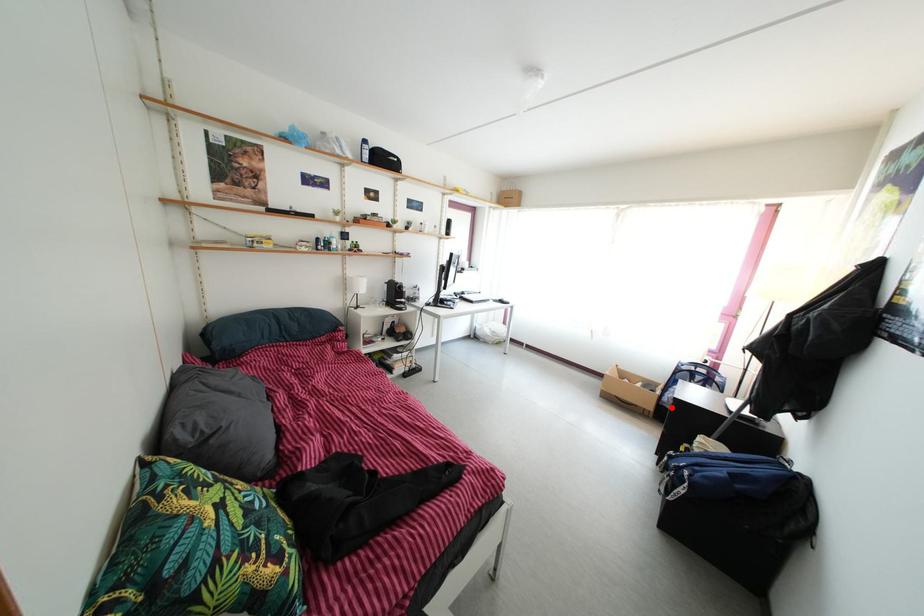
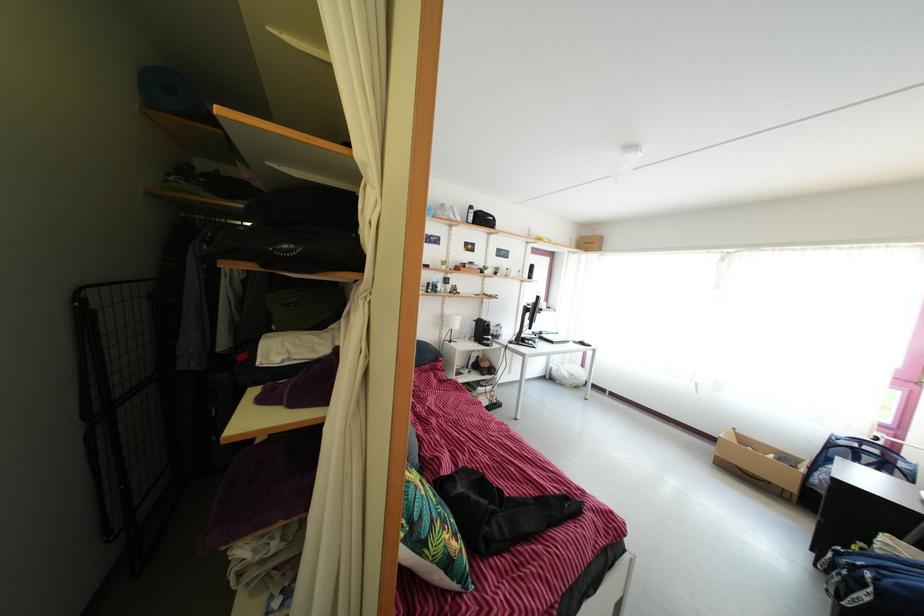
Question: I am providing you with two images of the same scene from different viewpoints. In image1, a red point is highlighted. Considering the same 3D point in image2, which of the following is correct?

Choices:
 (A) It is closer
 (B) It is farther

Answer: (B)